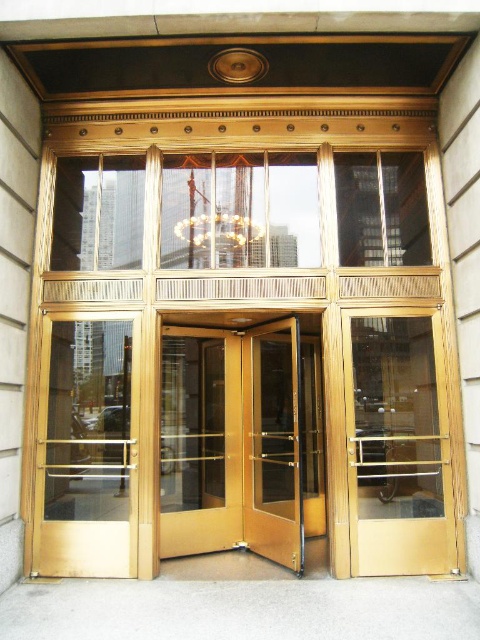
Question: Which of the following is the closest to the observer?

Choices:
 (A) (252, 515)
 (B) (435, 516)

Answer: (B)

Question: Which of the following is the closest to the observer?

Choices:
 (A) matte gold door at left
 (B) gold/glass door at center
 (C) gold polished door at center

Answer: (A)

Question: Is gold polished elevator at center wider than gold polished door at center?

Choices:
 (A) yes
 (B) no

Answer: (A)

Question: Is clear glass door at right further to the viewer compared to gold polished door at center?

Choices:
 (A) no
 (B) yes

Answer: (A)

Question: Among these points, which one is nearest to the camera?

Choices:
 (A) (126, 548)
 (B) (210, 333)

Answer: (A)

Question: Is gold polished elevator at center to the right of gold/glass door at center from the viewer's perspective?

Choices:
 (A) no
 (B) yes

Answer: (B)